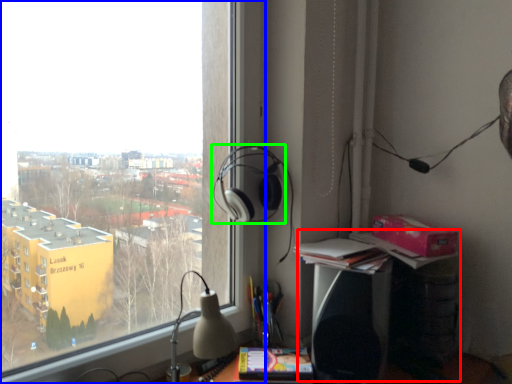
Question: Which object is positioned farthest from computer desk (highlighted by a red box)? Select from window (highlighted by a blue box) and headphones (highlighted by a green box).

Choices:
 (A) window
 (B) headphones

Answer: (A)